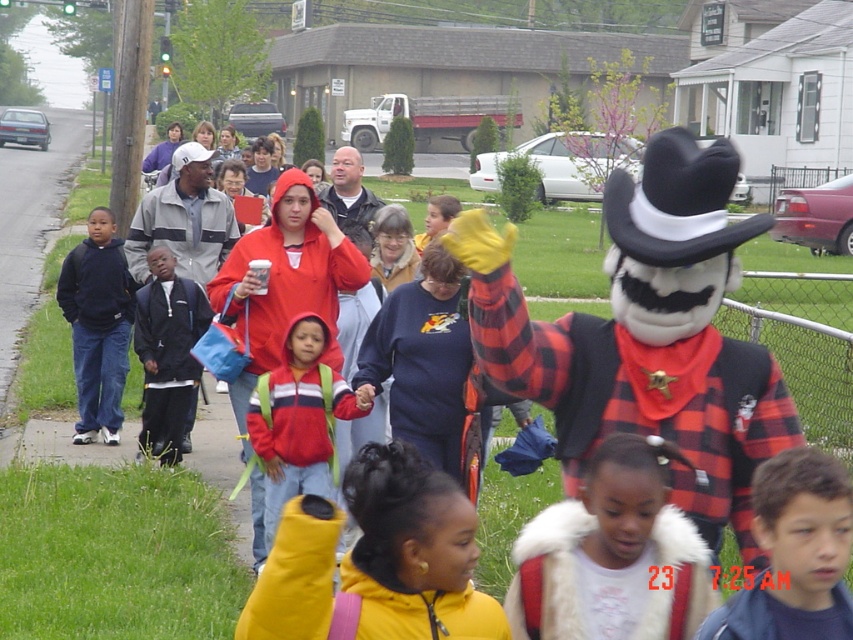
You are a photographer standing in the scene and want to take a photo of the yellow fuzzy glove at lower center and the dark blue jacket at left. Which object should you focus on first to ensure both are in the frame?

You should focus on the dark blue jacket at left first because the yellow fuzzy glove at lower center is in front of it, ensuring both will be visible in the frame.

You are a photographer trying to capture a clear shot of both the blue denim jacket at lower right and the yellow fuzzy glove at lower center. However, you notice that one of them is blocking the view of the other. Which object is being blocked by the other?

The yellow fuzzy glove at lower center is behind blue denim jacket at lower right, so the blue denim jacket at lower lower right is blocking the view of the yellow fuzzy glove at lower center.

You are a photographer trying to capture both the blue denim jacket at lower right and the red fleece jacket at center in a single frame. Which jacket will require you to zoom in more to include its entire width in the photo?

The blue denim jacket at lower right requires more zooming in because its width is smaller than the red fleece jacket at center.